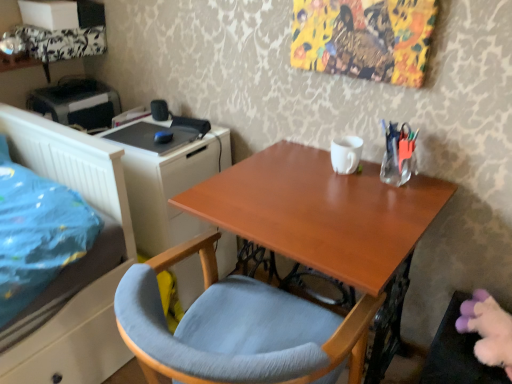
The height and width of the screenshot is (384, 512). What do you see at coordinates (166, 177) in the screenshot? I see `white matte file cabinet at left` at bounding box center [166, 177].

What is the approximate height of light blue fabric chair at center?

It is 28.68 inches.

You are a GUI agent. You are given a task and a screenshot of the screen. Output one action in this format:
    pyautogui.click(x=<x>, y=<y>)
    Task: Click on the white matte file cabinet at left
    
    Given the screenshot: What is the action you would take?
    pyautogui.click(x=166, y=177)

From a real-world perspective, is wooden desk at center physically located above or below white matte file cabinet at left?

From a real-world perspective, wooden desk at center is physically above white matte file cabinet at left.

Is wooden desk at center turned away from white matte file cabinet at left?

No, wooden desk at center's orientation is not away from white matte file cabinet at left.

Can you confirm if wooden desk at center is positioned to the right of white matte file cabinet at left?

Yes, wooden desk at center is to the right of white matte file cabinet at left.

Between wooden desk at center and white matte file cabinet at left, which one has larger size?

Bigger between the two is wooden desk at center.

From the picture: From a real-world perspective, which object stands above the other?

black plastic printer at upper left.

Which object is positioned more to the left, wooden desk at center or black plastic printer at upper left?

From the viewer's perspective, black plastic printer at upper left appears more on the left side.

Is black plastic printer at upper left surrounded by wooden desk at center?

Definitely not — black plastic printer at upper left is not inside wooden desk at center.

Which is farther, (x=246, y=170) or (x=48, y=105)?

Point (x=48, y=105)

Is white matte file cabinet at left positioned with its back to clear glass vase at upper right?

white matte file cabinet at left does not have its back to clear glass vase at upper right.

From the image's perspective, is white matte file cabinet at left over clear glass vase at upper right?

No, from the image's perspective, white matte file cabinet at left is not over clear glass vase at upper right.

How far apart are white matte file cabinet at left and clear glass vase at upper right?

32.71 inches.

Considering the positions of objects white matte file cabinet at left and clear glass vase at upper right in the image provided, who is more to the left, white matte file cabinet at left or clear glass vase at upper right?

Positioned to the left is white matte file cabinet at left.

Consider the image. Considering the sizes of objects wooden desk at center and light blue fabric chair at center in the image provided, who is smaller, wooden desk at center or light blue fabric chair at center?

Smaller between the two is light blue fabric chair at center.

Does point (329, 266) come farther from viewer compared to point (166, 374)?

That is False.

Is wooden desk at center taller than light blue fabric chair at center?

Yes.

Between clear glass vase at upper right and white matte file cabinet at left, which one has larger width?

With larger width is white matte file cabinet at left.

Is clear glass vase at upper right to the left or to the right of white matte file cabinet at left in the image?

clear glass vase at upper right is to the right of white matte file cabinet at left.

Is clear glass vase at upper right closer to camera compared to white matte file cabinet at left?

Yes, clear glass vase at upper right is closer to the viewer.

Looking at this image, would you consider clear glass vase at upper right to be distant from white matte file cabinet at left?

That's not correct — clear glass vase at upper right is a little close to white matte file cabinet at left.

Do you think black plastic printer at upper left is within light blue fabric chair at center, or outside of it?

black plastic printer at upper left cannot be found inside light blue fabric chair at center.

From the image's perspective, which is below, black plastic printer at upper left or light blue fabric chair at center?

light blue fabric chair at center, from the image's perspective.

Which object is further away from the camera, black plastic printer at upper left or light blue fabric chair at center?

black plastic printer at upper left is more distant.

You are a GUI agent. You are given a task and a screenshot of the screen. Output one action in this format:
    pyautogui.click(x=<x>, y=<y>)
    Task: Click on the file cabinet located underneath the black plastic printer at upper left (from a real-world perspective)
    Image resolution: width=512 pixels, height=384 pixels.
    Given the screenshot: What is the action you would take?
    pyautogui.click(x=166, y=177)

Does white matte file cabinet at left have a greater height compared to black plastic printer at upper left?

Correct, white matte file cabinet at left is much taller as black plastic printer at upper left.

How many degrees apart are the facing directions of white matte file cabinet at left and black plastic printer at upper left?

0.129 degrees separate the facing orientations of white matte file cabinet at left and black plastic printer at upper left.

Which object is positioned more to the left, white matte file cabinet at left or black plastic printer at upper left?

black plastic printer at upper left is more to the left.

Where is `file cabinet lying above the wooden desk at center (from the image's perspective)`? file cabinet lying above the wooden desk at center (from the image's perspective) is located at coordinates (166, 177).

Locate an element on the screen. The height and width of the screenshot is (384, 512). desk that is on the right side of black plastic printer at upper left is located at coordinates (327, 221).

Considering their positions, is black plastic printer at upper left positioned closer to wooden desk at center than light blue fabric chair at center?

Based on the image, light blue fabric chair at center appears to be nearer to wooden desk at center.

Considering their positions, is wooden desk at center positioned further to clear glass vase at upper right than white matte file cabinet at left?

Among the two, white matte file cabinet at left is located further to clear glass vase at upper right.

When comparing their distances from light blue fabric chair at center, does clear glass vase at upper right or wooden desk at center seem closer?

wooden desk at center is closer to light blue fabric chair at center.

Which object lies nearer to the anchor point light blue fabric chair at center, clear glass vase at upper right or black plastic printer at upper left?

Among the two, clear glass vase at upper right is located nearer to light blue fabric chair at center.

Considering their positions, is black plastic printer at upper left positioned further to white matte file cabinet at left than wooden desk at center?

Based on the image, black plastic printer at upper left appears to be further to white matte file cabinet at left.

Estimate the real-world distances between objects in this image. Which object is further from wooden desk at center, clear glass vase at upper right or white matte file cabinet at left?

white matte file cabinet at left is further to wooden desk at center.

Looking at the image, which one is located closer to white matte file cabinet at left, light blue fabric chair at center or clear glass vase at upper right?

Based on the image, light blue fabric chair at center appears to be nearer to white matte file cabinet at left.

Estimate the real-world distances between objects in this image. Which object is closer to clear glass vase at upper right, black plastic printer at upper left or white matte file cabinet at left?

white matte file cabinet at left is positioned closer to the anchor clear glass vase at upper right.

At what (x,y) coordinates should I click in order to perform the action: click on file cabinet located between light blue fabric chair at center and black plastic printer at upper left in the depth direction. Please return your answer as a coordinate pair (x, y). This screenshot has height=384, width=512. Looking at the image, I should click on (166, 177).

Locate an element on the screen. stationery between light blue fabric chair at center and white matte file cabinet at left in the front-back direction is located at coordinates (398, 154).

Where is `file cabinet between black plastic printer at upper left and clear glass vase at upper right in the horizontal direction`? The width and height of the screenshot is (512, 384). file cabinet between black plastic printer at upper left and clear glass vase at upper right in the horizontal direction is located at coordinates pos(166,177).

Identify the location of file cabinet between black plastic printer at upper left and wooden desk at center in the horizontal direction. The image size is (512, 384). (166, 177).